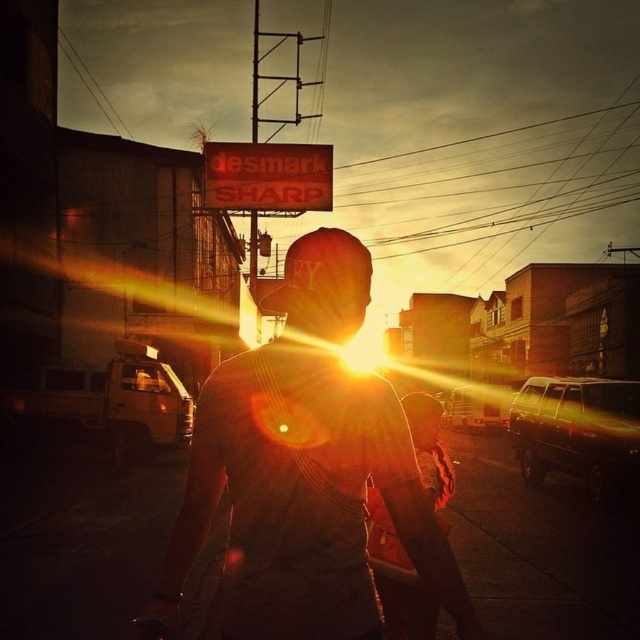
Question: Is dark gray t-shirt at center further to the viewer compared to red plastic sign at upper center?

Choices:
 (A) yes
 (B) no

Answer: (B)

Question: Which point is farther from the camera taking this photo?

Choices:
 (A) (321, 552)
 (B) (273, 152)

Answer: (B)

Question: Can you confirm if dark gray t-shirt at center is bigger than red plastic sign at upper center?

Choices:
 (A) yes
 (B) no

Answer: (B)

Question: Does dark gray t-shirt at center appear on the left side of red plastic sign at upper center?

Choices:
 (A) yes
 (B) no

Answer: (B)

Question: Which point is closer to the camera?

Choices:
 (A) dark gray t-shirt at center
 (B) red plastic sign at upper center

Answer: (A)